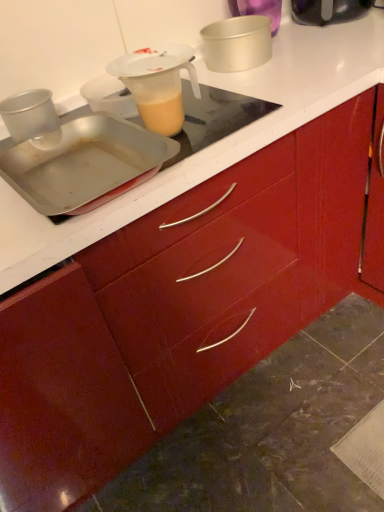
Question: From the image's perspective, is metallic silver cup at left, which appears as the first kitchen appliance when viewed from the left, on top of metallic silver tray at upper left, which ranks as the 1th kitchen appliance in bottom-to-top order?

Choices:
 (A) no
 (B) yes

Answer: (B)

Question: Could metallic silver tray at upper left, arranged as the fourth kitchen appliance when viewed from the top, be considered to be inside metallic silver cup at left, positioned as the third kitchen appliance in top-to-bottom order?

Choices:
 (A) no
 (B) yes

Answer: (A)

Question: Can we say metallic silver cup at left, positioned as the third kitchen appliance in top-to-bottom order, lies outside metallic silver tray at upper left, which is the third kitchen appliance in right-to-left order?

Choices:
 (A) yes
 (B) no

Answer: (A)

Question: Considering the relative sizes of metallic silver cup at left, positioned as the third kitchen appliance in top-to-bottom order, and metallic silver tray at upper left, the 2th kitchen appliance from the left, in the image provided, is metallic silver cup at left, positioned as the third kitchen appliance in top-to-bottom order, wider than metallic silver tray at upper left, the 2th kitchen appliance from the left,?

Choices:
 (A) no
 (B) yes

Answer: (A)

Question: From the image's perspective, does metallic silver cup at left, positioned as the third kitchen appliance in top-to-bottom order, appear lower than metallic silver tray at upper left, which ranks as the 1th kitchen appliance in bottom-to-top order?

Choices:
 (A) no
 (B) yes

Answer: (A)

Question: Is metallic silver cup at left, the fourth kitchen appliance positioned from the right, spatially inside metallic silver tray at upper left, arranged as the fourth kitchen appliance when viewed from the top, or outside of it?

Choices:
 (A) inside
 (B) outside

Answer: (B)

Question: In terms of size, does metallic silver cup at left, the fourth kitchen appliance positioned from the right, appear bigger or smaller than metallic silver tray at upper left, arranged as the fourth kitchen appliance when viewed from the top?

Choices:
 (A) small
 (B) big

Answer: (A)

Question: Is metallic silver cup at left, which appears as the first kitchen appliance when viewed from the left, to the left or to the right of metallic silver tray at upper left, which ranks as the 1th kitchen appliance in bottom-to-top order, in the image?

Choices:
 (A) right
 (B) left

Answer: (B)

Question: Considering their positions, is metallic silver cup at left, positioned as the third kitchen appliance in top-to-bottom order, located in front of or behind metallic silver tray at upper left, which is the third kitchen appliance in right-to-left order?

Choices:
 (A) front
 (B) behind

Answer: (B)

Question: From the image's perspective, is metallic silver cake pan at upper center, which is counted as the third kitchen appliance, starting from the bottom, above or below metallic silver tray at upper left, the 2th kitchen appliance from the left?

Choices:
 (A) above
 (B) below

Answer: (A)

Question: Is point (218, 25) closer or farther from the camera than point (66, 165)?

Choices:
 (A) farther
 (B) closer

Answer: (A)

Question: From a real-world perspective, is metallic silver cake pan at upper center, which is counted as the third kitchen appliance, starting from the bottom, physically located above or below metallic silver tray at upper left, arranged as the fourth kitchen appliance when viewed from the top?

Choices:
 (A) above
 (B) below

Answer: (A)

Question: In terms of height, does metallic silver cake pan at upper center, the second kitchen appliance in the top-to-bottom sequence, look taller or shorter compared to metallic silver tray at upper left, arranged as the fourth kitchen appliance when viewed from the top?

Choices:
 (A) short
 (B) tall

Answer: (B)

Question: Is translucent plastic jug at upper center in front of or behind metallic silver cake pan at upper center, the third kitchen appliance in the left-to-right sequence, in the image?

Choices:
 (A) behind
 (B) front

Answer: (B)

Question: Is point (175, 89) positioned closer to the camera than point (240, 40)?

Choices:
 (A) closer
 (B) farther

Answer: (A)